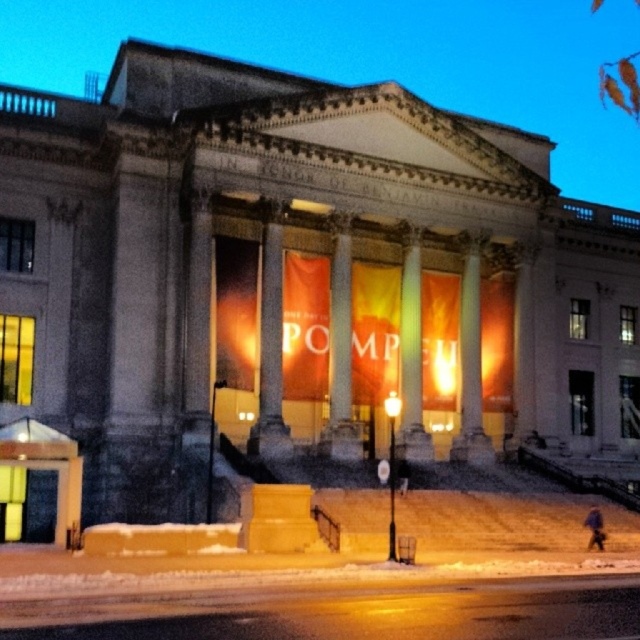
You are standing in front of the grand neoclassical building and want to take a photo of both the matte stone columns at center and the white marble pillar at center. Which object should you focus on first to ensure both are in the frame?

You should focus on the matte stone columns at center first since it is closer to you than the white marble pillar at center, ensuring both are in the frame by adjusting the camera angle accordingly.

You are an architect examining the building facade. You notice two white marble structures at the center of the building. Which one is narrower between the white marble pillar at center and the white marble column at center?

The white marble pillar at center is narrower than the white marble column at center.

You are standing in front of the grand neoclassical building and notice two points marked in the image. The first point is at coordinate point (518, 44) and the second is at point (273, 374). Which of these points is closer to the entrance marked by the orange banners?

Point (273, 374) is closer to the entrance marked by the orange banners because it is in front of point (518, 44).